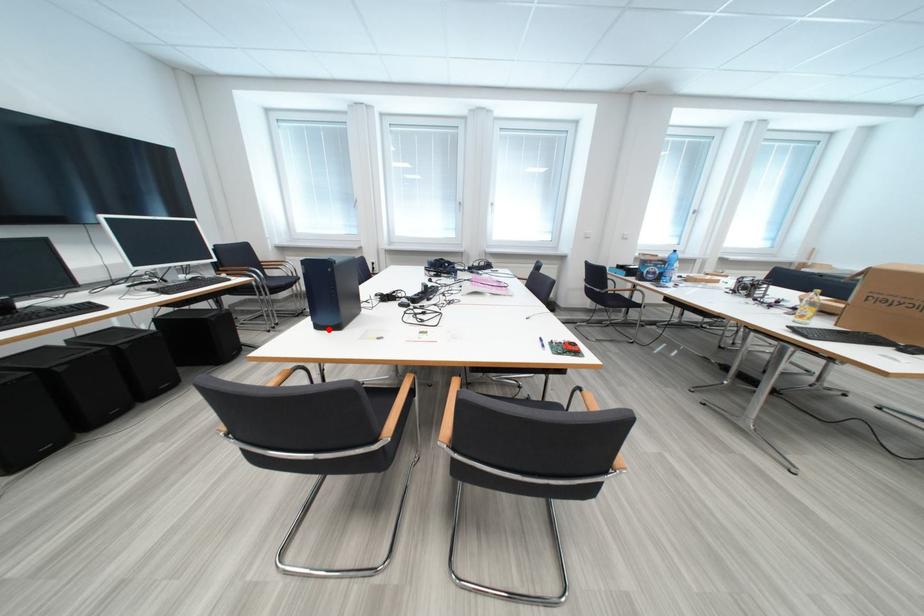
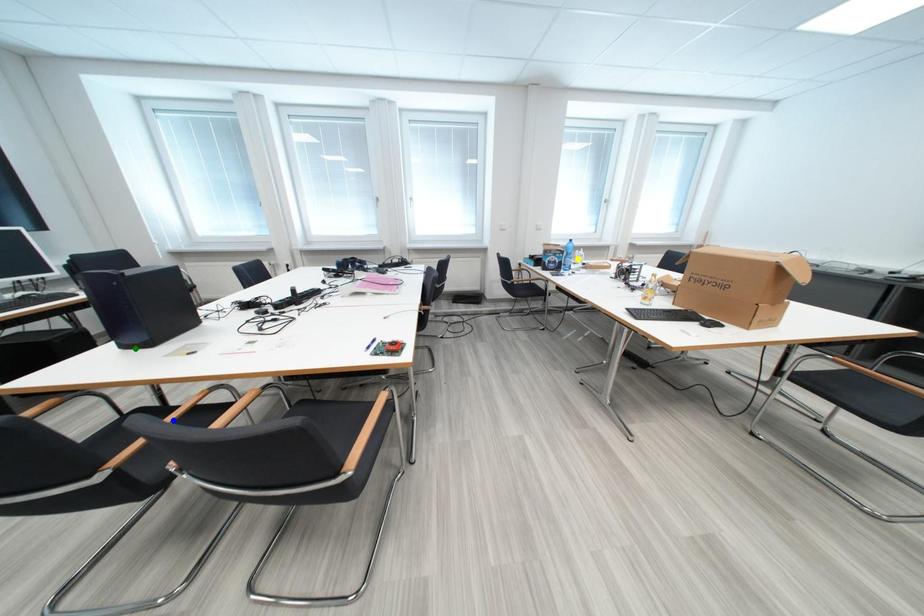
Question: I am providing you with two images of the same scene from different viewpoints. A red point is marked on the first image. You are given multiple points on the second image. Can you choose the point in image 2 that corresponds to the point in image 1?

Choices:
 (A) yellow point
 (B) blue point
 (C) green point

Answer: (C)